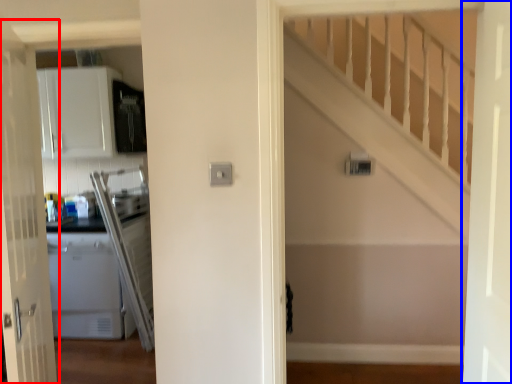
Question: Among these objects, which one is farthest to the camera, door (highlighted by a red box) or door (highlighted by a blue box)?

Choices:
 (A) door
 (B) door

Answer: (A)